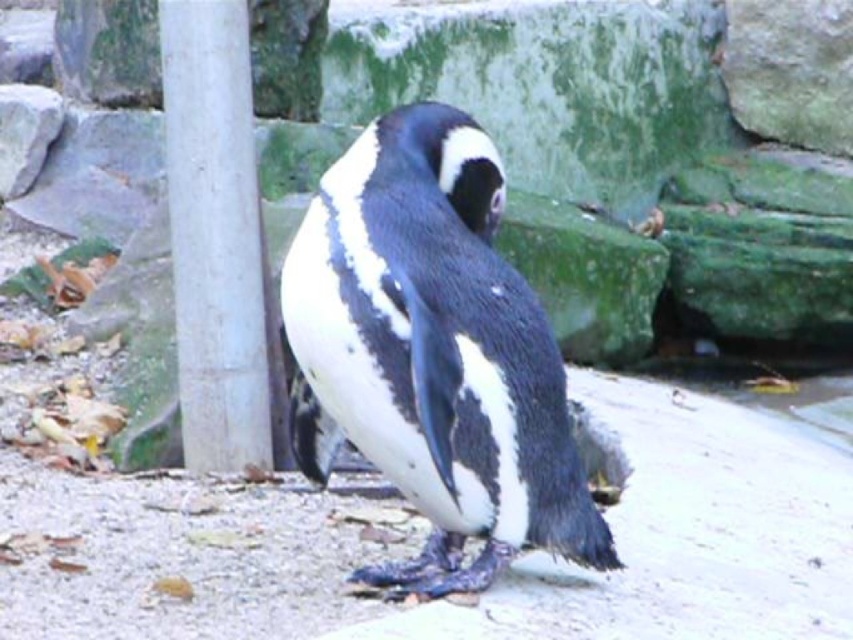
Question: Considering the relative positions of black-feathered penguin at center and white smooth pole at left in the image provided, where is black-feathered penguin at center located with respect to white smooth pole at left?

Choices:
 (A) above
 (B) below

Answer: (B)

Question: Is black-feathered penguin at center smaller than white smooth pole at left?

Choices:
 (A) no
 (B) yes

Answer: (A)

Question: Among these points, which one is farthest from the camera?

Choices:
 (A) (515, 548)
 (B) (178, 268)

Answer: (B)

Question: Is black-feathered penguin at center further to the viewer compared to white smooth pole at left?

Choices:
 (A) yes
 (B) no

Answer: (B)